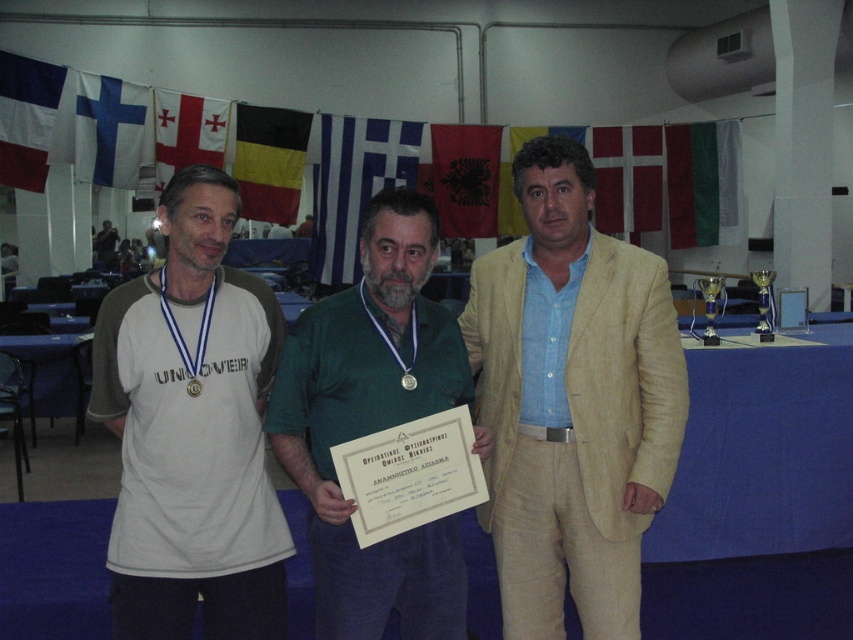
Question: Does beige linen suit at center have a lesser width compared to white fabric flag at upper center?

Choices:
 (A) yes
 (B) no

Answer: (B)

Question: Is beige linen suit at center below blue fabric flag at center?

Choices:
 (A) no
 (B) yes

Answer: (B)

Question: Which object appears farthest from the camera in this image?

Choices:
 (A) beige linen suit at center
 (B) blue fabric flag at upper left
 (C) green fabric flag at upper right

Answer: (C)

Question: Estimate the real-world distances between objects in this image. Which object is closer to the blue fabric flag at upper left?

Choices:
 (A) green fabric flag at upper right
 (B) white fabric flag at upper center
 (C) black fabric flag at center

Answer: (B)

Question: Which point appears closest to the camera in this image?

Choices:
 (A) (387, 200)
 (B) (228, 620)
 (C) (24, 88)
 (D) (490, 221)

Answer: (A)

Question: Does blue fabric flag at center lie in front of white fabric flag at upper center?

Choices:
 (A) yes
 (B) no

Answer: (B)